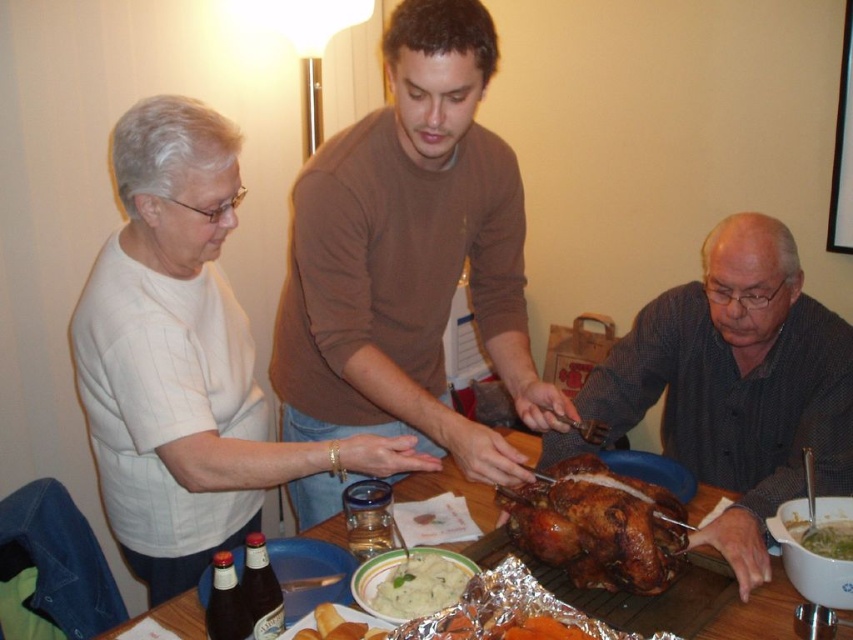
You are a guest at the family gathering and want to pass the carving knife to the dark gray shirt at center without touching the wooden table at center. Is this possible?

The dark gray shirt at center is above the wooden table at center, so yes, you can pass the carving knife to the dark gray shirt at center without touching the wooden table at center by placing it directly in their hand or on a plate without letting it rest on the table.